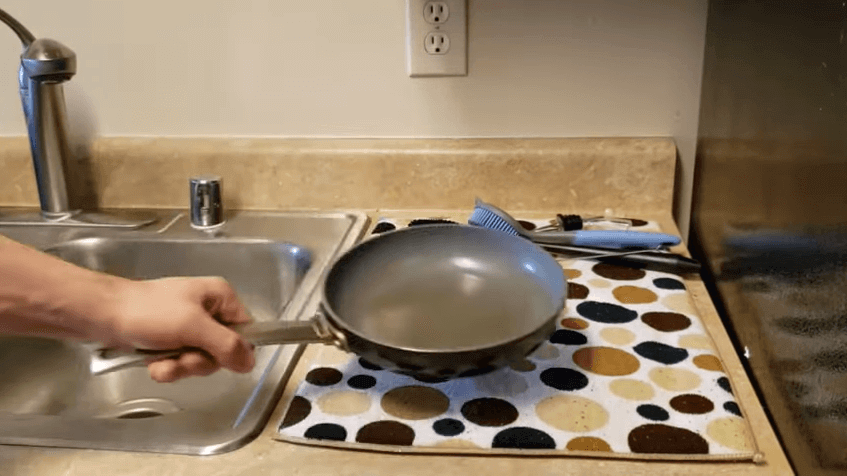
Find the location of a particular element. frying pan handle is located at coordinates coord(268,333).